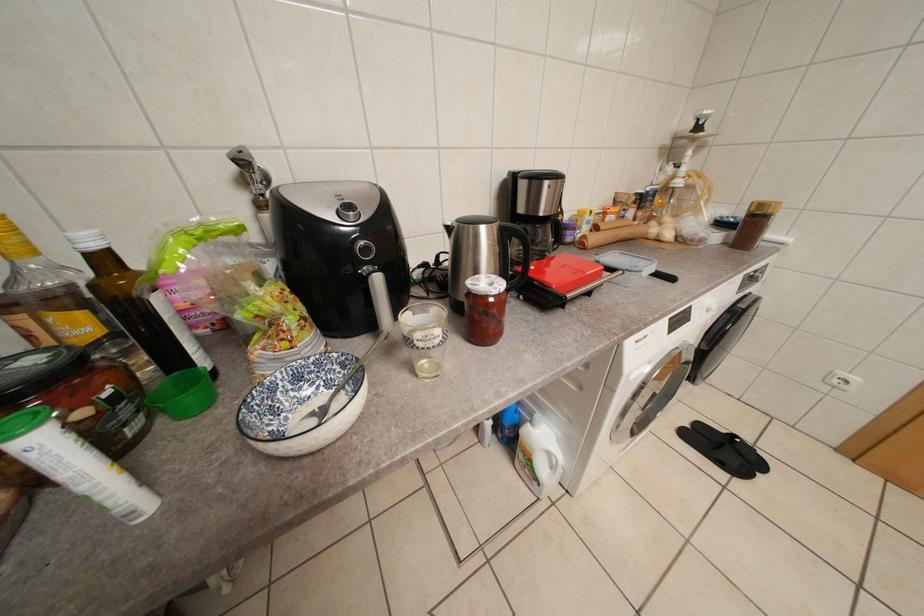
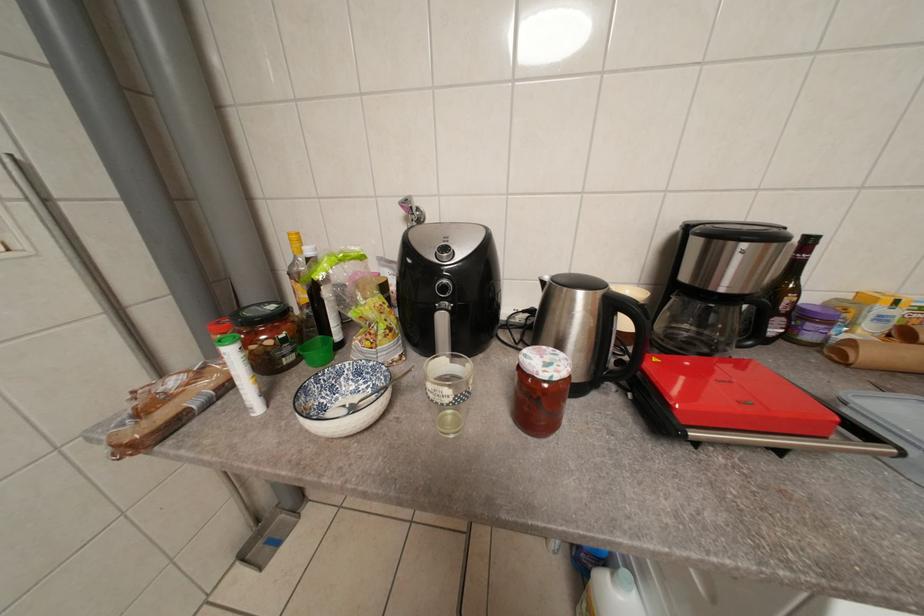
Question: How did the camera likely rotate?

Choices:
 (A) Left
 (B) Right
 (C) Up
 (D) Down

Answer: (A)